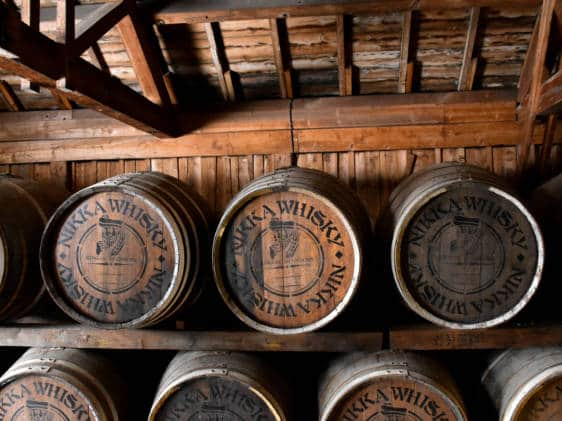
Where is `black cord`? This screenshot has height=421, width=562. black cord is located at coordinates (288, 134).